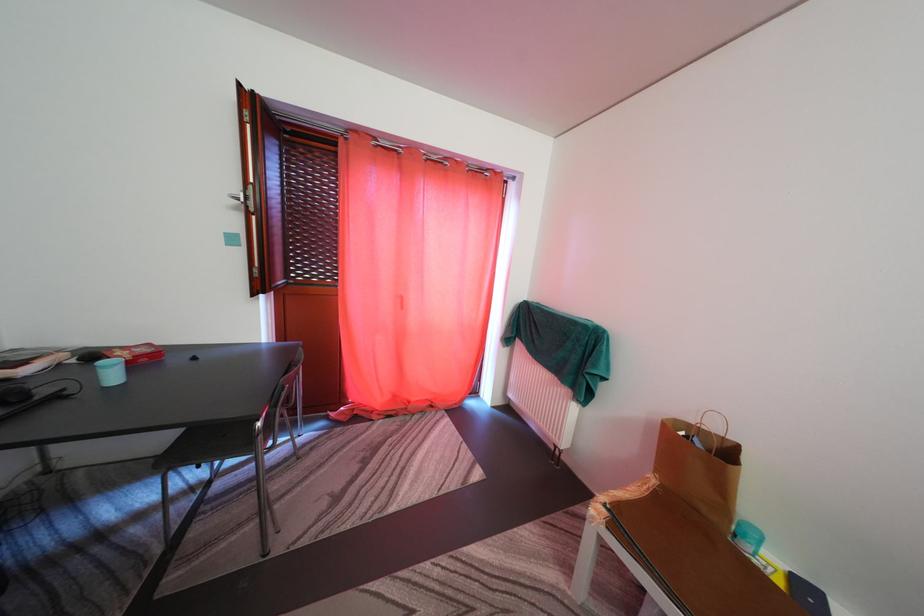
The height and width of the screenshot is (616, 924). Find the location of `chair sitting surface`. chair sitting surface is located at coordinates (212, 444).